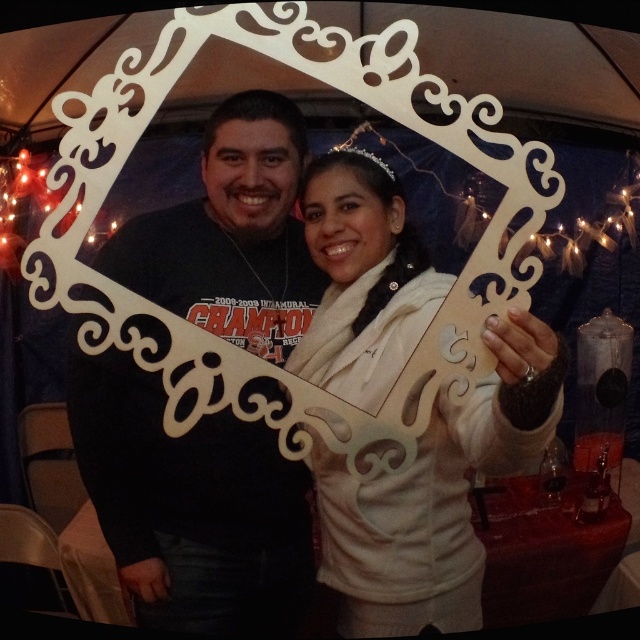
Where is `black matte t-shirt at center`? black matte t-shirt at center is located at coordinates (189, 506).

Which is behind, point (234, 547) or point (376, 275)?

Point (234, 547)

Image resolution: width=640 pixels, height=640 pixels. Find the location of `black matte t-shirt at center`. black matte t-shirt at center is located at coordinates (189, 506).